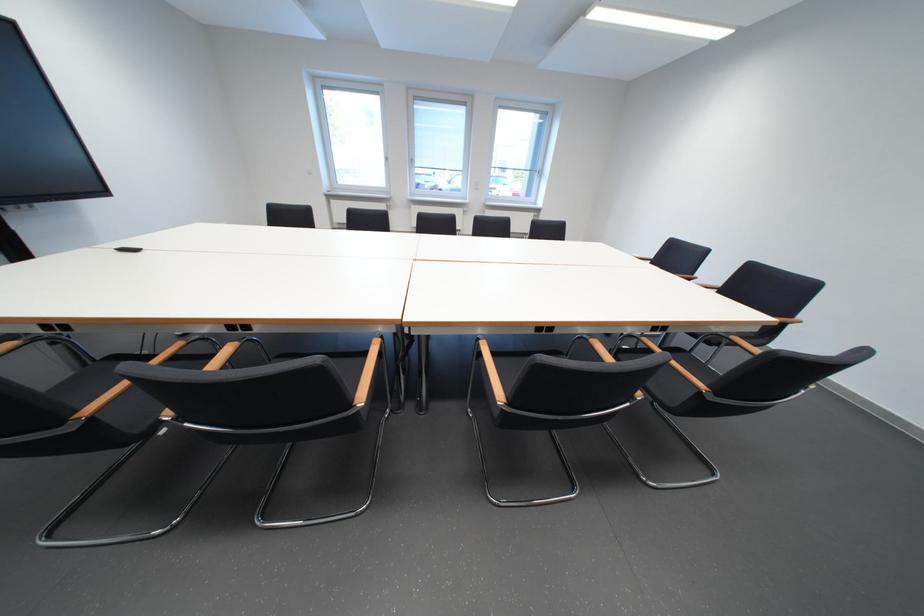
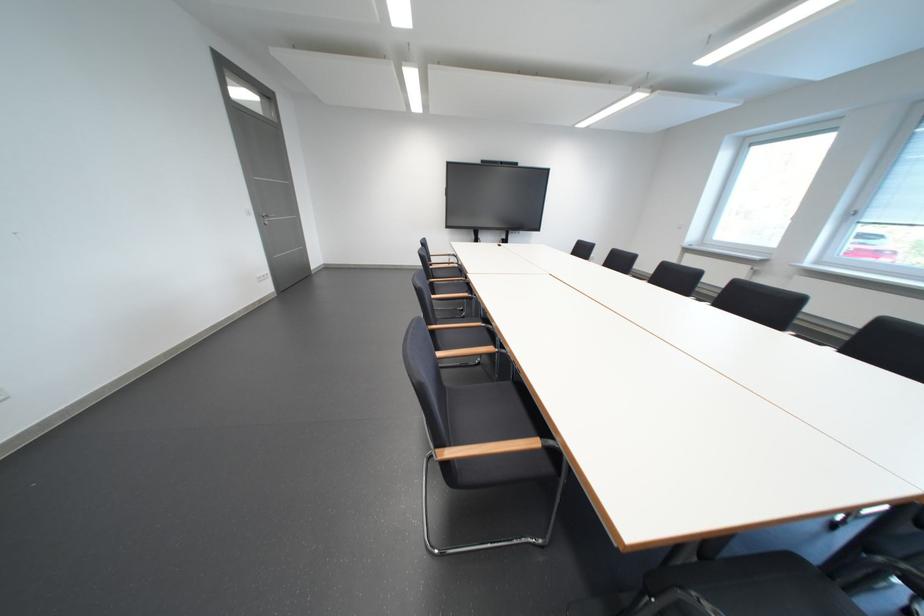
Question: I am providing you with two images of the same scene from different viewpoints. Which of the following objects are not visible in image2?

Choices:
 (A) black chair sitting surface
 (B) silver door handle
 (C) chair sitting surface
 (D) orange candle holder

Answer: (C)